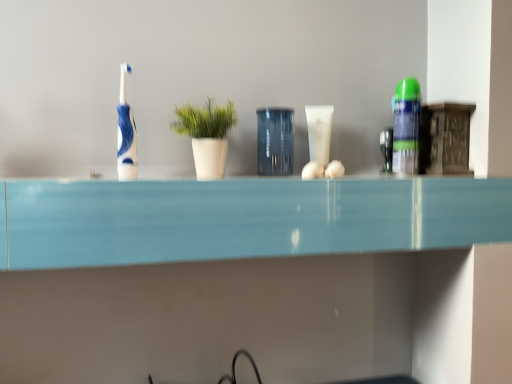
Measure the distance between blue glossy toothbrush at left and camera.

blue glossy toothbrush at left and camera are 29.13 inches apart.

From the picture: Measure the distance between green matte shaving cream can at right, acting as the 2th toiletry starting from the left, and camera.

green matte shaving cream can at right, acting as the 2th toiletry starting from the left, is 87.07 centimeters from camera.

Identify the location of transparent glass jar at center. This screenshot has height=384, width=512. (275, 141).

Where is `white glossy tube at center, the second toiletry viewed from the right`? The image size is (512, 384). white glossy tube at center, the second toiletry viewed from the right is located at coordinates (319, 132).

Where is `green matte plant at center`? The width and height of the screenshot is (512, 384). green matte plant at center is located at coordinates (207, 135).

From a real-world perspective, which is physically below, green matte plant at center or white glossy tube at center, the second toiletry viewed from the right?

green matte plant at center.

Choose the correct answer: Is green matte plant at center inside white glossy tube at center, the second toiletry viewed from the right, or outside it?

The correct answer is: outside.

Does green matte plant at center come in front of white glossy tube at center, arranged as the 1th toiletry when viewed from the left?

Yes, it is in front of white glossy tube at center, arranged as the 1th toiletry when viewed from the left.

Does point (203, 173) come behind point (313, 110)?

No, it is in front of (313, 110).

From their relative heights in the image, would you say blue glossy toothbrush at left is taller or shorter than white glossy tube at center, arranged as the 1th toiletry when viewed from the left?

blue glossy toothbrush at left is taller than white glossy tube at center, arranged as the 1th toiletry when viewed from the left.

Is blue glossy toothbrush at left closer to camera compared to white glossy tube at center, the second toiletry viewed from the right?

Yes, blue glossy toothbrush at left is closer to the camera.

Looking at the image, does blue glossy toothbrush at left seem bigger or smaller compared to white glossy tube at center, the second toiletry viewed from the right?

blue glossy toothbrush at left is bigger than white glossy tube at center, the second toiletry viewed from the right.

Find the location of a particular element. The width and height of the screenshot is (512, 384). toothbrush that appears above the white glossy tube at center, the second toiletry viewed from the right (from a real-world perspective) is located at coordinates (126, 130).

From the image's perspective, is green matte shaving cream can at right, acting as the 2th toiletry starting from the left, beneath transparent glass jar at center?

Actually, green matte shaving cream can at right, acting as the 2th toiletry starting from the left, appears above transparent glass jar at center in the image.

From a real-world perspective, who is located higher, green matte shaving cream can at right, the first toiletry in the right-to-left sequence, or transparent glass jar at center?

green matte shaving cream can at right, the first toiletry in the right-to-left sequence, is physically above.

Looking at this image, could you measure the distance between green matte shaving cream can at right, the first toiletry in the right-to-left sequence, and transparent glass jar at center?

A distance of 9.77 inches exists between green matte shaving cream can at right, the first toiletry in the right-to-left sequence, and transparent glass jar at center.

Which object is further away from the camera taking this photo, green matte shaving cream can at right, the first toiletry in the right-to-left sequence, or transparent glass jar at center?

Positioned behind is green matte shaving cream can at right, the first toiletry in the right-to-left sequence.

Is transparent glass jar at center at the back of green matte plant at center?

No, transparent glass jar at center is not at the back of green matte plant at center.

From a real-world perspective, is green matte plant at center positioned above or below transparent glass jar at center?

Clearly, from a real-world perspective, green matte plant at center is above transparent glass jar at center.

Which is more to the left, green matte plant at center or transparent glass jar at center?

Positioned to the left is green matte plant at center.

Between green matte plant at center and transparent glass jar at center, which one is positioned behind?

transparent glass jar at center is further away from the camera.

Can you confirm if blue glossy toothbrush at left is positioned to the right of green matte shaving cream can at right, the first toiletry in the right-to-left sequence?

In fact, blue glossy toothbrush at left is to the left of green matte shaving cream can at right, the first toiletry in the right-to-left sequence.

Who is shorter, blue glossy toothbrush at left or green matte shaving cream can at right, the first toiletry in the right-to-left sequence?

green matte shaving cream can at right, the first toiletry in the right-to-left sequence.

Can we say blue glossy toothbrush at left lies outside green matte shaving cream can at right, the first toiletry in the right-to-left sequence?

blue glossy toothbrush at left lies outside green matte shaving cream can at right, the first toiletry in the right-to-left sequence,'s area.

Is there a large distance between blue glossy toothbrush at left and green matte shaving cream can at right, acting as the 2th toiletry starting from the left?

No, there isn't a large distance between blue glossy toothbrush at left and green matte shaving cream can at right, acting as the 2th toiletry starting from the left.

Between point (406, 152) and point (125, 77), which one is positioned behind?

The point (406, 152) is farther from the camera.

Considering their positions, is green matte shaving cream can at right, acting as the 2th toiletry starting from the left, located in front of or behind blue glossy toothbrush at left?

green matte shaving cream can at right, acting as the 2th toiletry starting from the left, is positioned farther from the viewer than blue glossy toothbrush at left.

Choose the correct answer: Is green matte shaving cream can at right, acting as the 2th toiletry starting from the left, inside blue glossy toothbrush at left or outside it?

green matte shaving cream can at right, acting as the 2th toiletry starting from the left, is outside blue glossy toothbrush at left.

From their relative heights in the image, would you say green matte shaving cream can at right, the first toiletry in the right-to-left sequence, is taller or shorter than blue glossy toothbrush at left?

green matte shaving cream can at right, the first toiletry in the right-to-left sequence, is shorter than blue glossy toothbrush at left.

Is point (289, 166) closer or farther from the camera than point (310, 140)?

Point (289, 166).

Considering the sizes of transparent glass jar at center and white glossy tube at center, arranged as the 1th toiletry when viewed from the left, in the image, is transparent glass jar at center wider or thinner than white glossy tube at center, arranged as the 1th toiletry when viewed from the left,?

In the image, transparent glass jar at center appears to be wider than white glossy tube at center, arranged as the 1th toiletry when viewed from the left.

Which object is closer to the camera taking this photo, transparent glass jar at center or white glossy tube at center, the second toiletry viewed from the right?

transparent glass jar at center is in front.

From the image's perspective, who appears lower, transparent glass jar at center or white glossy tube at center, arranged as the 1th toiletry when viewed from the left?

transparent glass jar at center, from the image's perspective.

You are a GUI agent. You are given a task and a screenshot of the screen. Output one action in this format:
    pyautogui.click(x=<x>, y=<y>)
    Task: Click on the toiletry that is the 1st one above the green matte plant at center (from a real-world perspective)
    Image resolution: width=512 pixels, height=384 pixels.
    Given the screenshot: What is the action you would take?
    pyautogui.click(x=319, y=132)

Locate an element on the screen. The width and height of the screenshot is (512, 384). toothbrush in front of the white glossy tube at center, arranged as the 1th toiletry when viewed from the left is located at coordinates (126, 130).

Consider the image. Estimate the real-world distances between objects in this image. Which object is further from blue glossy toothbrush at left, green matte shaving cream can at right, the first toiletry in the right-to-left sequence, or green matte plant at center?

Based on the image, green matte shaving cream can at right, the first toiletry in the right-to-left sequence, appears to be further to blue glossy toothbrush at left.

From the image, which object appears to be nearer to blue glossy toothbrush at left, green matte shaving cream can at right, the first toiletry in the right-to-left sequence, or transparent glass jar at center?

Based on the image, transparent glass jar at center appears to be nearer to blue glossy toothbrush at left.

When comparing their distances from white glossy tube at center, the second toiletry viewed from the right, does blue glossy toothbrush at left or transparent glass jar at center seem closer?

Based on the image, transparent glass jar at center appears to be nearer to white glossy tube at center, the second toiletry viewed from the right.

Based on their spatial positions, is white glossy tube at center, the second toiletry viewed from the right, or blue glossy toothbrush at left further from green matte shaving cream can at right, the first toiletry in the right-to-left sequence?

The object further to green matte shaving cream can at right, the first toiletry in the right-to-left sequence, is blue glossy toothbrush at left.

From the image, which object appears to be nearer to green matte plant at center, transparent glass jar at center or blue glossy toothbrush at left?

The object closer to green matte plant at center is transparent glass jar at center.

Considering their positions, is white glossy tube at center, the second toiletry viewed from the right, positioned further to green matte plant at center than blue glossy toothbrush at left?

white glossy tube at center, the second toiletry viewed from the right.

When comparing their distances from blue glossy toothbrush at left, does white glossy tube at center, arranged as the 1th toiletry when viewed from the left, or green matte shaving cream can at right, acting as the 2th toiletry starting from the left, seem further?

green matte shaving cream can at right, acting as the 2th toiletry starting from the left, is positioned further to the anchor blue glossy toothbrush at left.

Which object lies nearer to the anchor point green matte plant at center, green matte shaving cream can at right, the first toiletry in the right-to-left sequence, or transparent glass jar at center?

transparent glass jar at center lies closer to green matte plant at center than the other object.

Where is `houseplant located between blue glossy toothbrush at left and transparent glass jar at center in the left-right direction`? The width and height of the screenshot is (512, 384). houseplant located between blue glossy toothbrush at left and transparent glass jar at center in the left-right direction is located at coordinates (207, 135).

Locate an element on the screen. The image size is (512, 384). glass vase between green matte plant at center and white glossy tube at center, the second toiletry viewed from the right, in the horizontal direction is located at coordinates (275, 141).

Image resolution: width=512 pixels, height=384 pixels. What are the coordinates of `houseplant between blue glossy toothbrush at left and green matte shaving cream can at right, acting as the 2th toiletry starting from the left, from left to right` in the screenshot? It's located at pos(207,135).

You are a GUI agent. You are given a task and a screenshot of the screen. Output one action in this format:
    pyautogui.click(x=<x>, y=<y>)
    Task: Click on the toiletry between transparent glass jar at center and green matte shaving cream can at right, acting as the 2th toiletry starting from the left, from left to right
    The width and height of the screenshot is (512, 384).
    Given the screenshot: What is the action you would take?
    pyautogui.click(x=319, y=132)